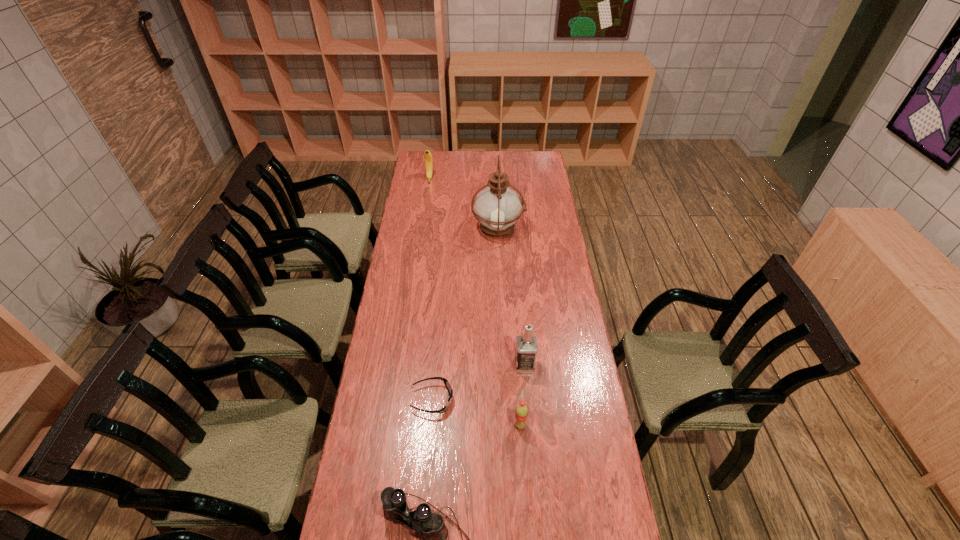
Where is `oil lamp`? The width and height of the screenshot is (960, 540). oil lamp is located at coordinates (497, 207).

Where is `the fifth nearest object`? This screenshot has height=540, width=960. the fifth nearest object is located at coordinates (497, 207).

I want to click on vodka, so click(x=526, y=345).

You are a GUI agent. You are given a task and a screenshot of the screen. Output one action in this format:
    pyautogui.click(x=<x>, y=<y>)
    Task: Click on the third farthest object
    
    Given the screenshot: What is the action you would take?
    pyautogui.click(x=526, y=345)

At what (x,y) coordinates should I click in order to perform the action: click on the fourth shortest object. Please return your answer as a coordinate pair (x, y). Image resolution: width=960 pixels, height=540 pixels. Looking at the image, I should click on (428, 158).

The width and height of the screenshot is (960, 540). What are the coordinates of `the farthest object` in the screenshot? It's located at (428, 158).

The height and width of the screenshot is (540, 960). What are the coordinates of `soda` in the screenshot? It's located at (521, 412).

Where is `the shortest object`? the shortest object is located at coordinates (447, 384).

At what (x,y) coordinates should I click in order to perform the action: click on sunglasses. Please return your answer as a coordinate pair (x, y). The width and height of the screenshot is (960, 540). Looking at the image, I should click on tap(447, 384).

This screenshot has height=540, width=960. Find the location of `vacant space situated on the back of the fifth nearest object`. vacant space situated on the back of the fifth nearest object is located at coordinates coord(495,171).